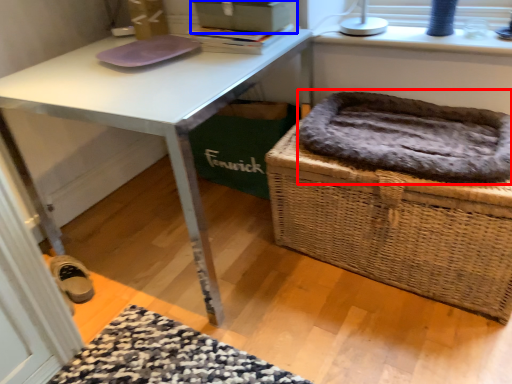
Question: Which point is further to the camera, cat bed (highlighted by a red box) or box (highlighted by a blue box)?

Choices:
 (A) cat bed
 (B) box

Answer: (B)